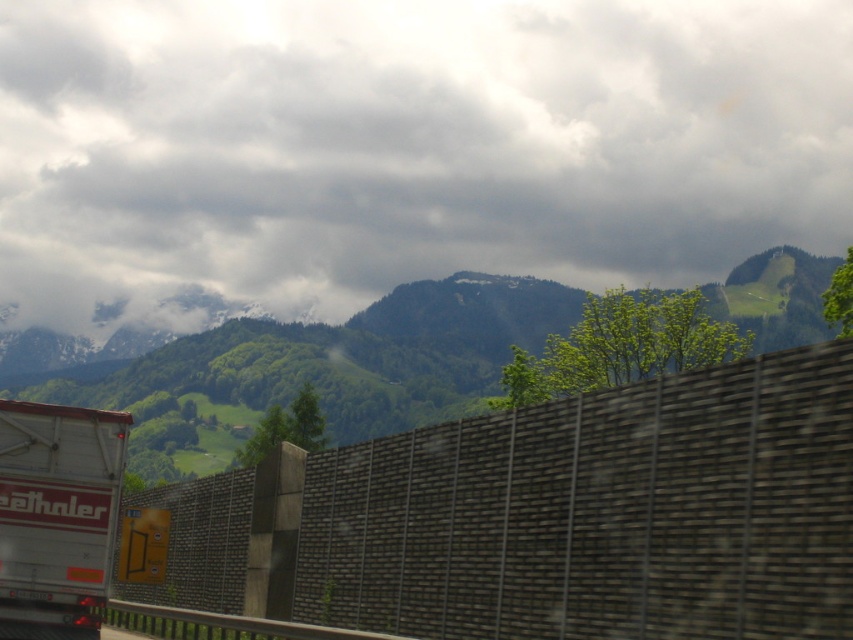
Describe the element at coordinates (404, 148) in the screenshot. I see `cloudy sky at upper center` at that location.

Does cloudy sky at upper center have a greater height compared to white matte trailer truck at left?

Correct, cloudy sky at upper center is much taller as white matte trailer truck at left.

You are a GUI agent. You are given a task and a screenshot of the screen. Output one action in this format:
    pyautogui.click(x=<x>, y=<y>)
    Task: Click on the cloudy sky at upper center
    Image resolution: width=853 pixels, height=640 pixels.
    Given the screenshot: What is the action you would take?
    point(404,148)

This screenshot has height=640, width=853. In order to click on cloudy sky at upper center in this screenshot , I will do `click(404, 148)`.

Where is `dark gray concrete wall at center`? dark gray concrete wall at center is located at coordinates (599, 513).

Between point (515, 625) and point (114, 522), which one is positioned in front?

Point (515, 625) is more forward.

Locate an element on the screen. The height and width of the screenshot is (640, 853). dark gray concrete wall at center is located at coordinates (599, 513).

Identify the location of dark gray concrete wall at center. (599, 513).

Who is positioned more to the left, cloudy sky at upper center or dark gray concrete wall at center?

Positioned to the left is dark gray concrete wall at center.

Is cloudy sky at upper center to the left of dark gray concrete wall at center from the viewer's perspective?

Incorrect, cloudy sky at upper center is not on the left side of dark gray concrete wall at center.

The height and width of the screenshot is (640, 853). What do you see at coordinates (404, 148) in the screenshot?
I see `cloudy sky at upper center` at bounding box center [404, 148].

Locate an element on the screen. cloudy sky at upper center is located at coordinates (404, 148).